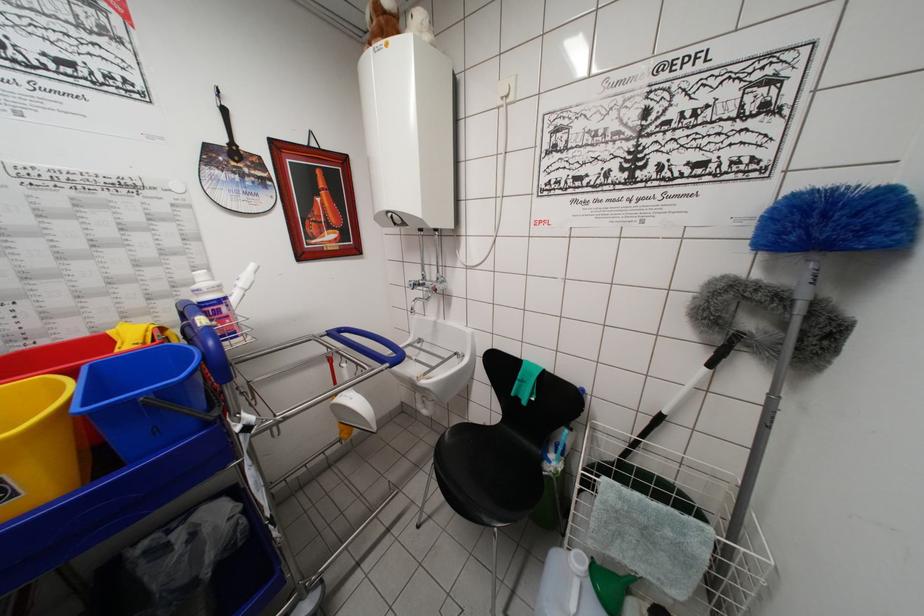
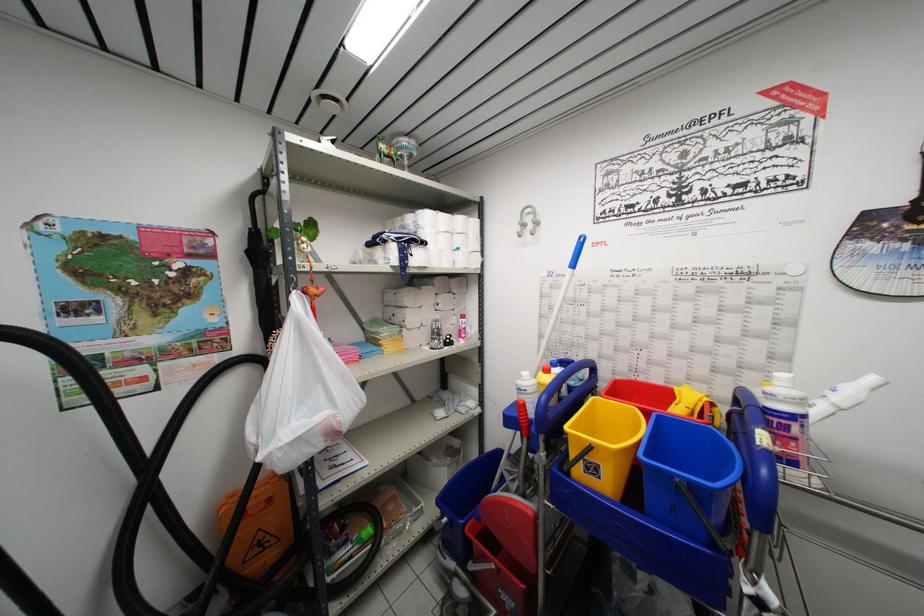
Locate, in the second image, the point that corresponds to pixel 215 315 in the first image.

(783, 428)